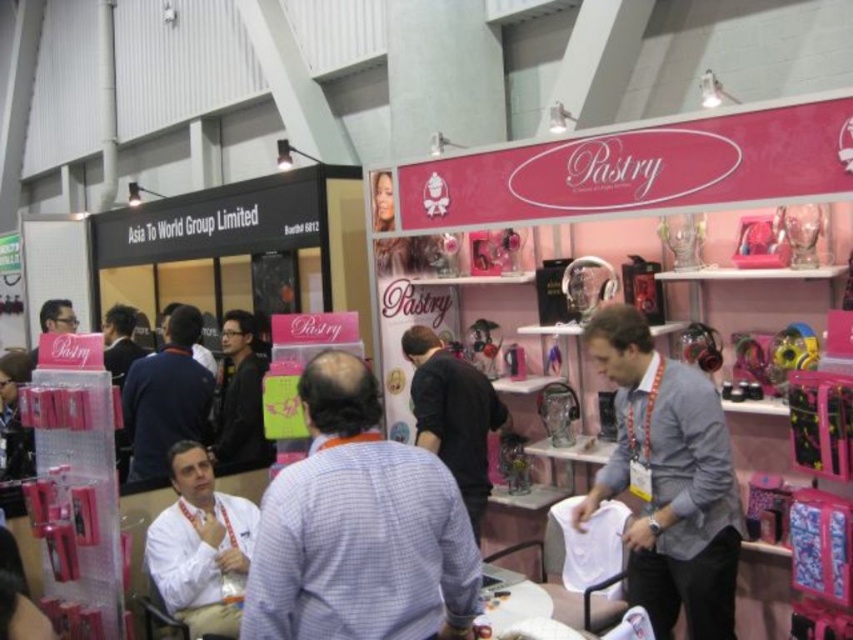
Question: Is light blue checkered shirt at center wider than black matte shirt at center?

Choices:
 (A) no
 (B) yes

Answer: (B)

Question: Can you confirm if matte black jacket at center is thinner than matte black shirt at center?

Choices:
 (A) no
 (B) yes

Answer: (A)

Question: Which point is farther to the camera?

Choices:
 (A) black matte shirt at center
 (B) matte black shirt at center
 (C) matte black jacket at center

Answer: (B)

Question: Which point is farther from the camera taking this photo?

Choices:
 (A) (706, 636)
 (B) (229, 445)

Answer: (B)

Question: Which point is farther to the camera?

Choices:
 (A) matte black shirt at center
 (B) white matte shirt at lower left

Answer: (A)

Question: Does black matte shirt at center appear over matte black jacket at center?

Choices:
 (A) no
 (B) yes

Answer: (B)